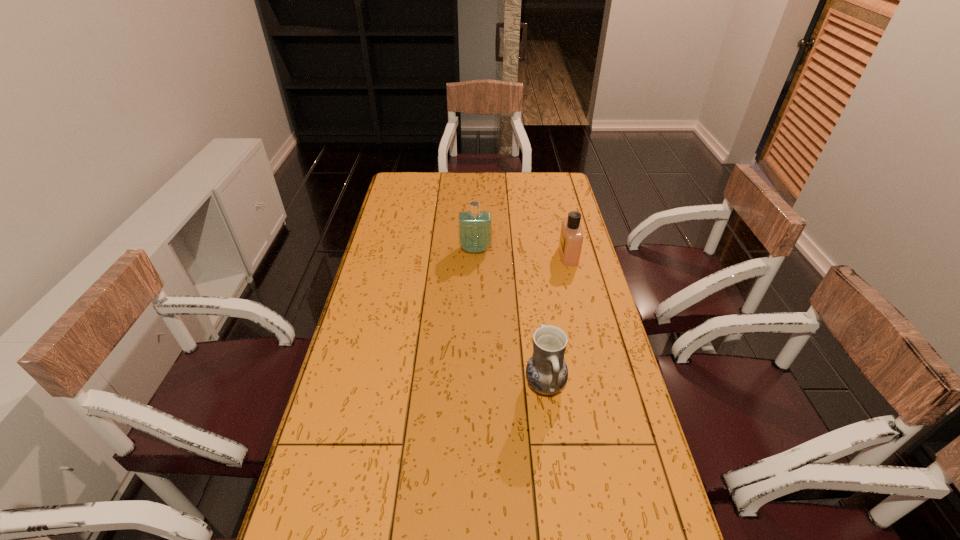
This screenshot has width=960, height=540. I want to click on vacant area between the second object from left to right and the right perfume, so click(557, 320).

You are a GUI agent. You are given a task and a screenshot of the screen. Output one action in this format:
    pyautogui.click(x=<x>, y=<y>)
    Task: Click on the object identified as the second closest to the nearest object
    Image resolution: width=960 pixels, height=540 pixels.
    Given the screenshot: What is the action you would take?
    pyautogui.click(x=474, y=227)

Identify which object is the second closest to the leftmost object. Please provide its 2D coordinates. Your answer should be formatted as a tuple, i.e. [(x, y)], where the tuple contains the x and y coordinates of a point satisfying the conditions above.

[(546, 371)]

You are a GUI agent. You are given a task and a screenshot of the screen. Output one action in this format:
    pyautogui.click(x=<x>, y=<y>)
    Task: Click on the closest perfume to the pottery
    
    Given the screenshot: What is the action you would take?
    pyautogui.click(x=571, y=237)

Where is `the closest perfume to the second object from left to right`? The width and height of the screenshot is (960, 540). the closest perfume to the second object from left to right is located at coordinates (571, 237).

Find the location of a particular element. vacant space that satisfies the following two spatial constraints: 1. on the front label of the left perfume; 2. on the right side of the nearest object is located at coordinates (473, 386).